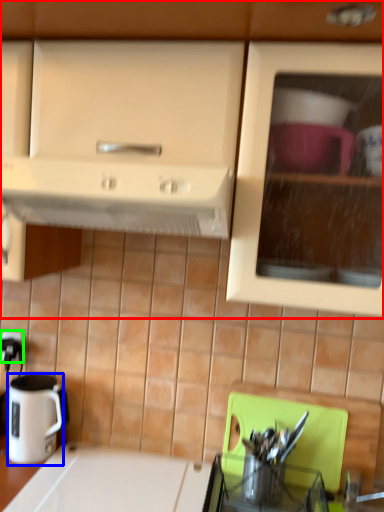
Question: Estimate the real-world distances between objects in this image. Which object is closer to cabinetry (highlighted by a red box), coffee cup (highlighted by a blue box) or electric outlet (highlighted by a green box)?

Choices:
 (A) coffee cup
 (B) electric outlet

Answer: (A)